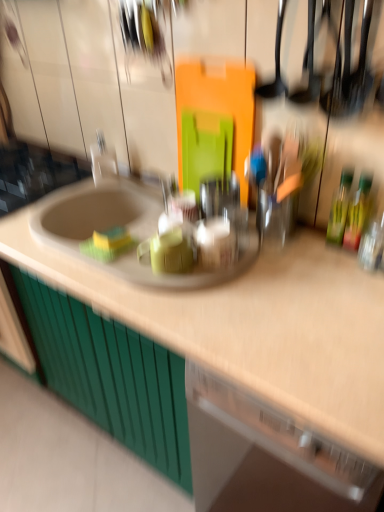
Question: From a real-world perspective, is white glossy faucet at upper left on green glass bottle at right, the 1th bottle when ordered from left to right?

Choices:
 (A) yes
 (B) no

Answer: (B)

Question: Does white glossy faucet at upper left lie behind green glass bottle at right, which ranks as the 2th bottle in right-to-left order?

Choices:
 (A) no
 (B) yes

Answer: (B)

Question: Does white glossy faucet at upper left have a smaller size compared to green glass bottle at right, the 1th bottle when ordered from left to right?

Choices:
 (A) yes
 (B) no

Answer: (B)

Question: Is white glossy faucet at upper left completely or partially outside of green glass bottle at right, the 1th bottle when ordered from left to right?

Choices:
 (A) no
 (B) yes

Answer: (B)

Question: Can you confirm if white glossy faucet at upper left is wider than green glass bottle at right, the 1th bottle when ordered from left to right?

Choices:
 (A) yes
 (B) no

Answer: (A)

Question: From a real-world perspective, is white glossy faucet at upper left positioned above or below green glass bottle at right, arranged as the first bottle when viewed from the right?

Choices:
 (A) below
 (B) above

Answer: (A)

Question: Which is correct: white glossy faucet at upper left is inside green glass bottle at right, arranged as the first bottle when viewed from the right, or outside of it?

Choices:
 (A) inside
 (B) outside

Answer: (B)

Question: Looking at their shapes, would you say white glossy faucet at upper left is wider or thinner than green glass bottle at right, marked as the second bottle in a left-to-right arrangement?

Choices:
 (A) wide
 (B) thin

Answer: (A)

Question: Looking at the image, does white glossy faucet at upper left seem bigger or smaller compared to green glass bottle at right, marked as the second bottle in a left-to-right arrangement?

Choices:
 (A) small
 (B) big

Answer: (B)

Question: Looking at their shapes, would you say green matte cabinet at lower left is wider or thinner than green glass bottle at right, which ranks as the 2th bottle in right-to-left order?

Choices:
 (A) thin
 (B) wide

Answer: (B)

Question: From a real-world perspective, is green matte cabinet at lower left physically located above or below green glass bottle at right, the 1th bottle when ordered from left to right?

Choices:
 (A) above
 (B) below

Answer: (B)

Question: Considering their positions, is green matte cabinet at lower left located in front of or behind green glass bottle at right, which ranks as the 2th bottle in right-to-left order?

Choices:
 (A) behind
 (B) front

Answer: (A)

Question: Is green matte cabinet at lower left inside or outside of green glass bottle at right, which ranks as the 2th bottle in right-to-left order?

Choices:
 (A) outside
 (B) inside

Answer: (A)

Question: In terms of width, does beige laminate countertop at center look wider or thinner when compared to green matte cabinet at lower left?

Choices:
 (A) thin
 (B) wide

Answer: (B)

Question: Which is correct: beige laminate countertop at center is inside green matte cabinet at lower left, or outside of it?

Choices:
 (A) outside
 (B) inside

Answer: (A)